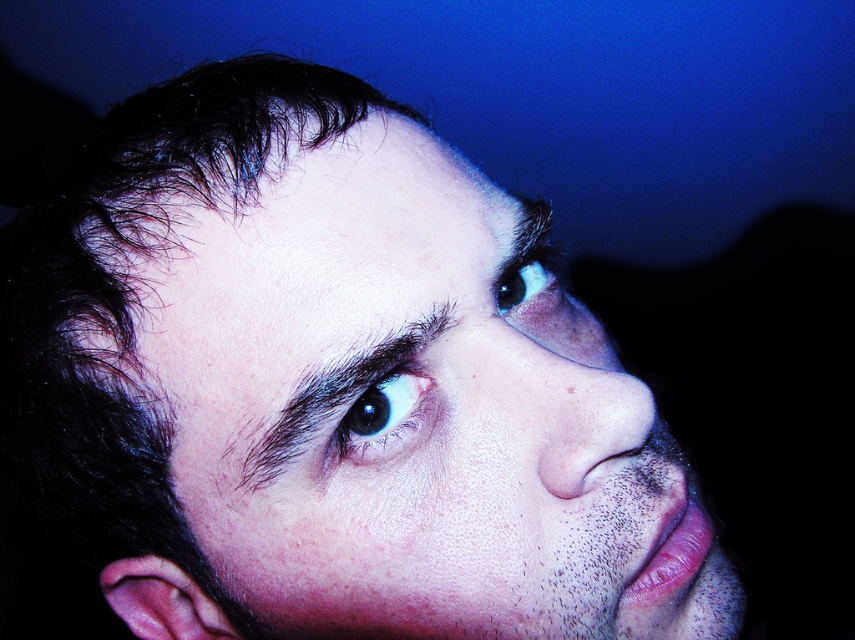
Who is lower down, dark brown hair at upper center or blue glossy eye at upper center?

dark brown hair at upper center

Which is behind, point (316, 381) or point (529, 269)?

Positioned behind is point (529, 269).

Which is behind, point (308, 385) or point (529, 278)?

Point (529, 278)

I want to click on dark brown hair at upper center, so click(340, 397).

Is dark brown hair at upper center further to the viewer compared to black glossy eye at center?

That is False.

Does dark brown hair at upper center appear on the left side of black glossy eye at center?

Indeed, dark brown hair at upper center is positioned on the left side of black glossy eye at center.

This screenshot has height=640, width=855. What do you see at coordinates (340, 397) in the screenshot?
I see `dark brown hair at upper center` at bounding box center [340, 397].

You are a GUI agent. You are given a task and a screenshot of the screen. Output one action in this format:
    pyautogui.click(x=<x>, y=<y>)
    Task: Click on the dark brown hair at upper center
    This screenshot has height=640, width=855.
    Given the screenshot: What is the action you would take?
    pyautogui.click(x=340, y=397)

Does smooth skin nose at center have a greater width compared to blue glossy eye at upper center?

Yes.

The width and height of the screenshot is (855, 640). What do you see at coordinates (590, 424) in the screenshot?
I see `smooth skin nose at center` at bounding box center [590, 424].

Find the location of `smooth skin nose at center`. smooth skin nose at center is located at coordinates (590, 424).